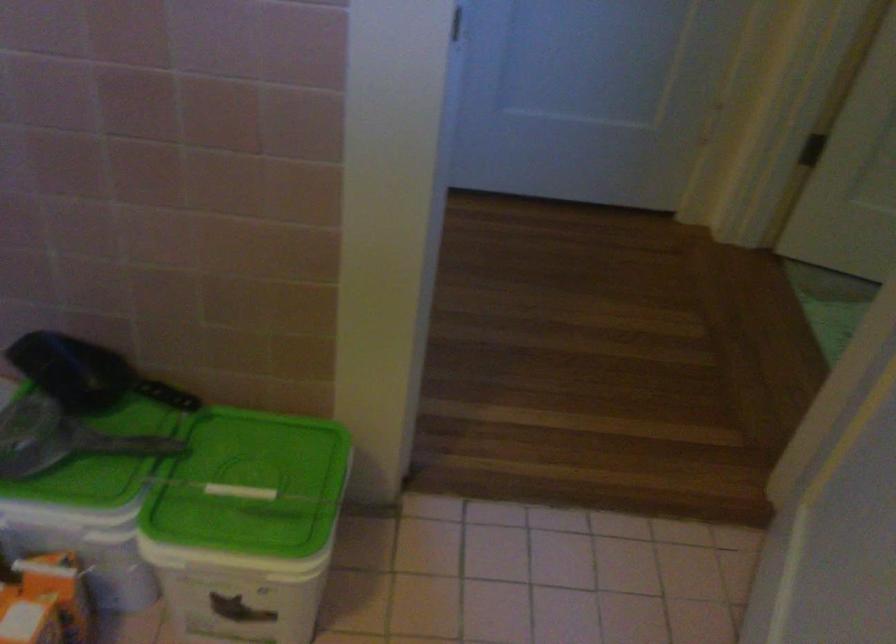
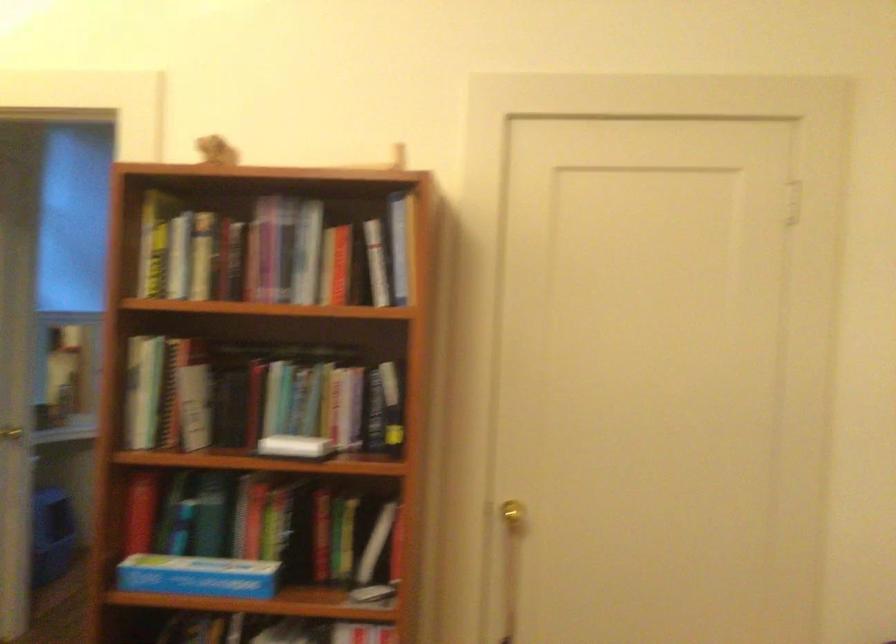
Question: I am providing you with two images of the same scene from different viewpoints. Please identify which objects are invisible in image2.

Choices:
 (A) large glass bottle
 (B) black scoop handle
 (C) book
 (D) silver door knob

Answer: (B)